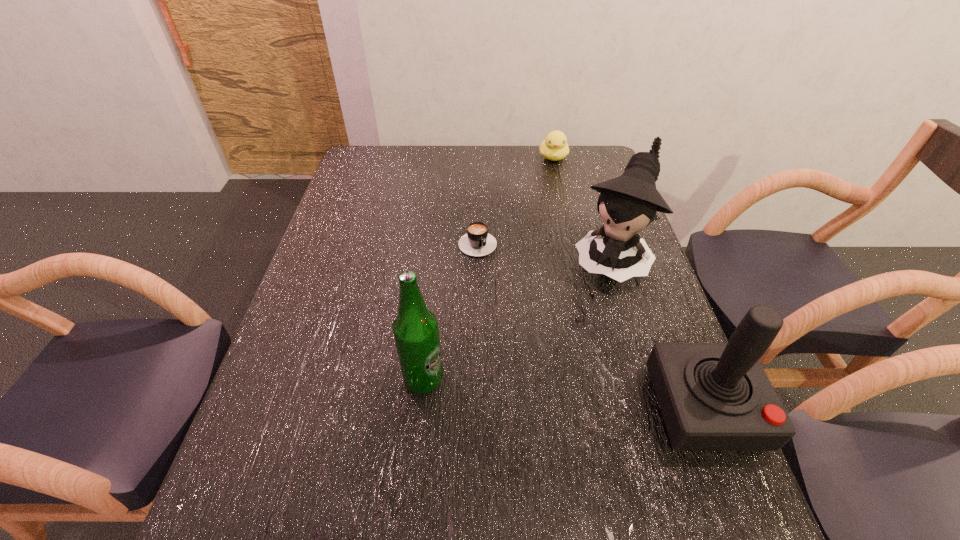
Where is `vacant area between the leftmost object and the cappuccino`? This screenshot has height=540, width=960. vacant area between the leftmost object and the cappuccino is located at coordinates (450, 309).

Image resolution: width=960 pixels, height=540 pixels. What are the coordinates of `free space between the beer bottle and the joystick` in the screenshot? It's located at (564, 393).

At what (x,y) coordinates should I click in order to perform the action: click on vacant space that is in between the duckling and the doll. Please return your answer as a coordinate pair (x, y). Image resolution: width=960 pixels, height=540 pixels. Looking at the image, I should click on (582, 208).

Identify the location of free spot between the beer bottle and the doll. (516, 320).

Where is `unoccupied area between the doll and the joystick`? This screenshot has height=540, width=960. unoccupied area between the doll and the joystick is located at coordinates (658, 333).

The height and width of the screenshot is (540, 960). Find the location of `empty space between the shortest object and the joystick`. empty space between the shortest object and the joystick is located at coordinates (591, 323).

Identify the location of vacant area between the shortest object and the doll. The image size is (960, 540). (543, 249).

Identify the location of free space that is in between the joystick and the second object from left to right. (591, 323).

The image size is (960, 540). Identify the location of free space between the joystick and the doll. (658, 333).

Image resolution: width=960 pixels, height=540 pixels. What are the coordinates of `object that is the fourth closest one to the doll` in the screenshot? It's located at (416, 331).